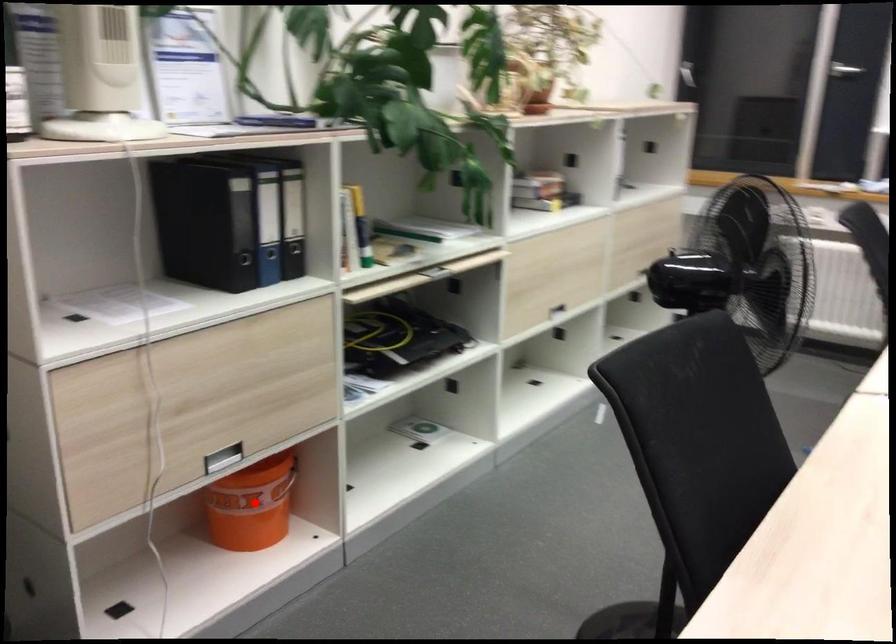
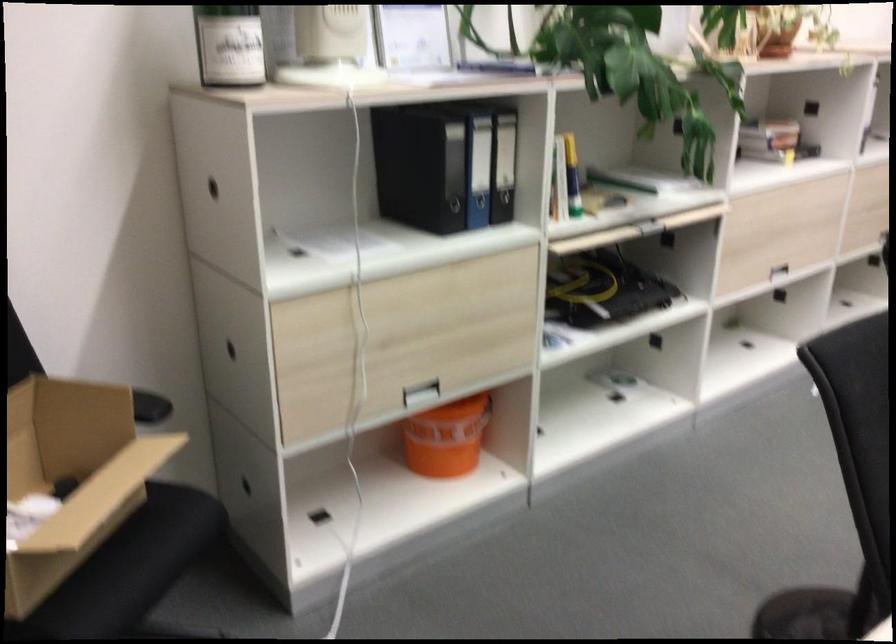
Find the pixel in the second image that matches the highlighted location in the first image.

(446, 438)